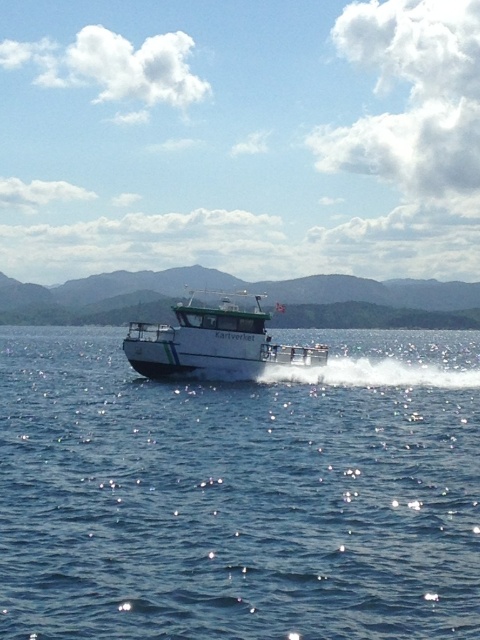
Question: Among these objects, which one is nearest to the camera?

Choices:
 (A) blue water at center
 (B) white glossy boat at center

Answer: (A)

Question: Is blue water at center positioned at the back of white glossy boat at center?

Choices:
 (A) yes
 (B) no

Answer: (B)

Question: Can you confirm if blue water at center is smaller than white glossy boat at center?

Choices:
 (A) no
 (B) yes

Answer: (B)

Question: Which point is closer to the camera?

Choices:
 (A) blue water at center
 (B) white glossy boat at center

Answer: (A)

Question: Does blue water at center come behind white glossy boat at center?

Choices:
 (A) yes
 (B) no

Answer: (B)